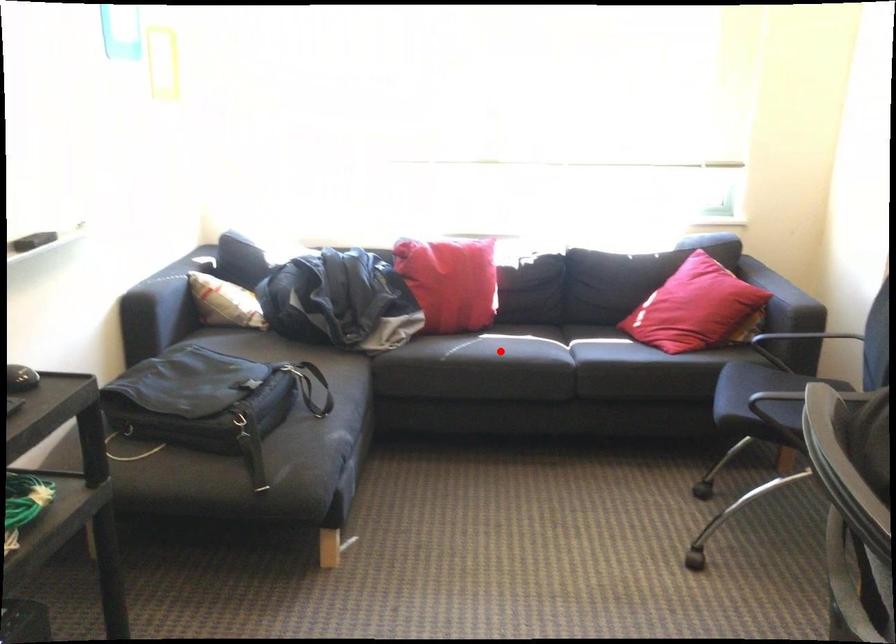
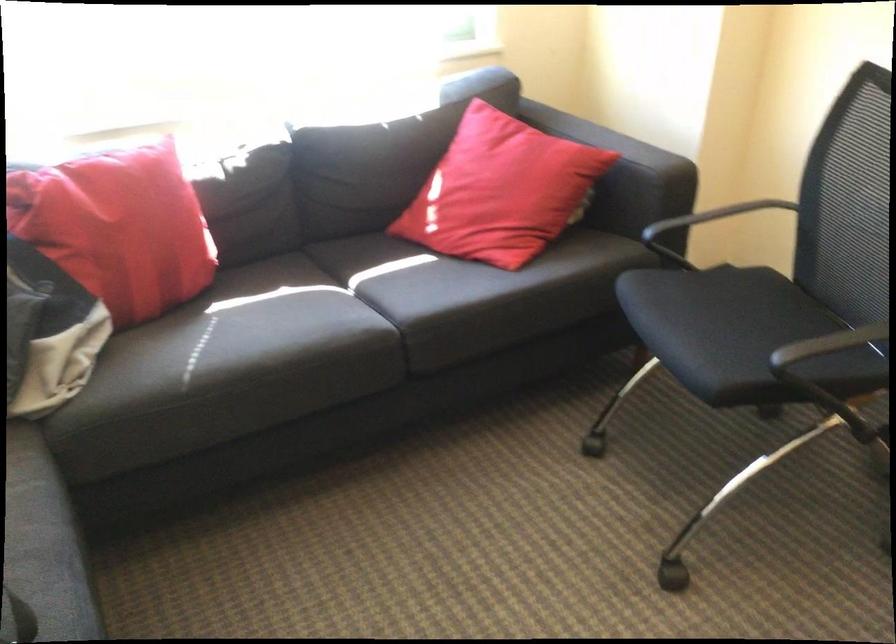
Find the pixel in the second image that matches the highlighted location in the first image.

(280, 346)